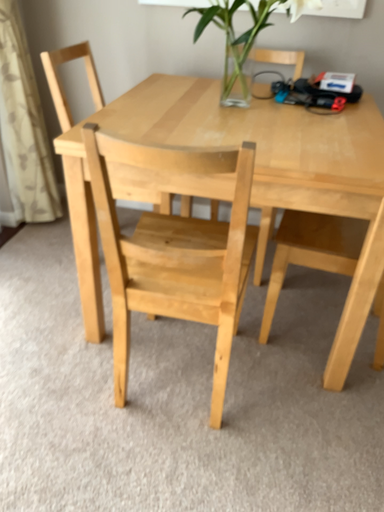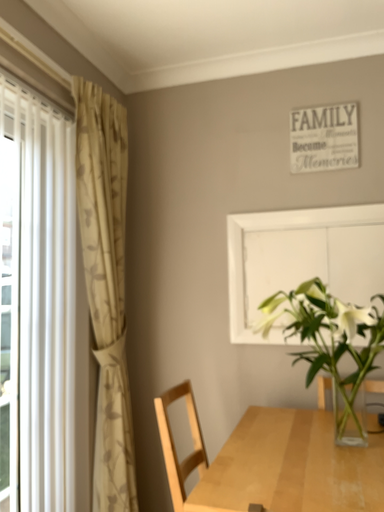
Question: How did the camera likely rotate when shooting the video?

Choices:
 (A) rotated downward
 (B) rotated upward

Answer: (B)